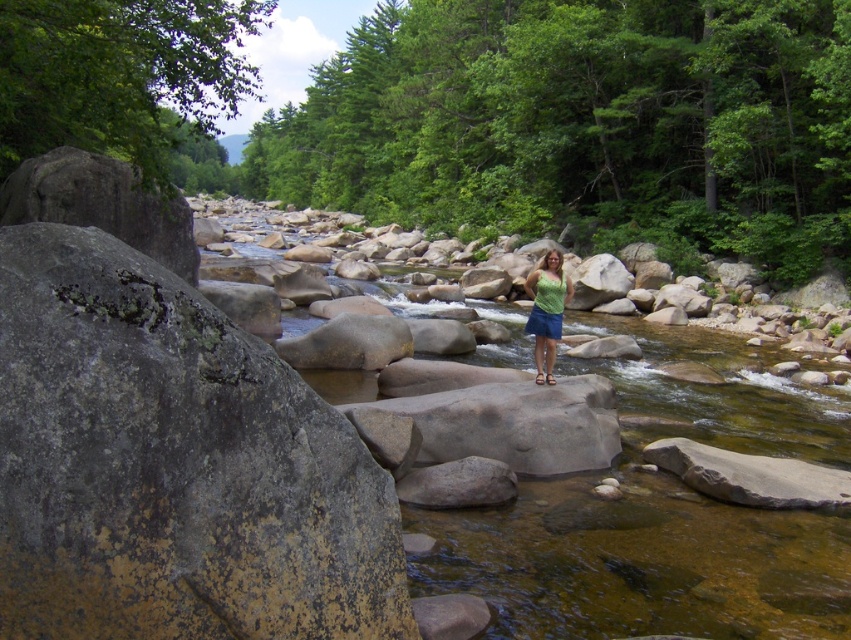
You are standing in the middle of the riverbed and notice the clear water at center and the blue denim shorts at center. Which object is closer to you?

The clear water at center is closer to you because it is in front of the blue denim shorts at center.

You are standing at the point marked as point (660, 515) in the image. What is the type of surface you are currently standing on?

The surface at point (660, 515) is clear water at center, so you are standing on water.